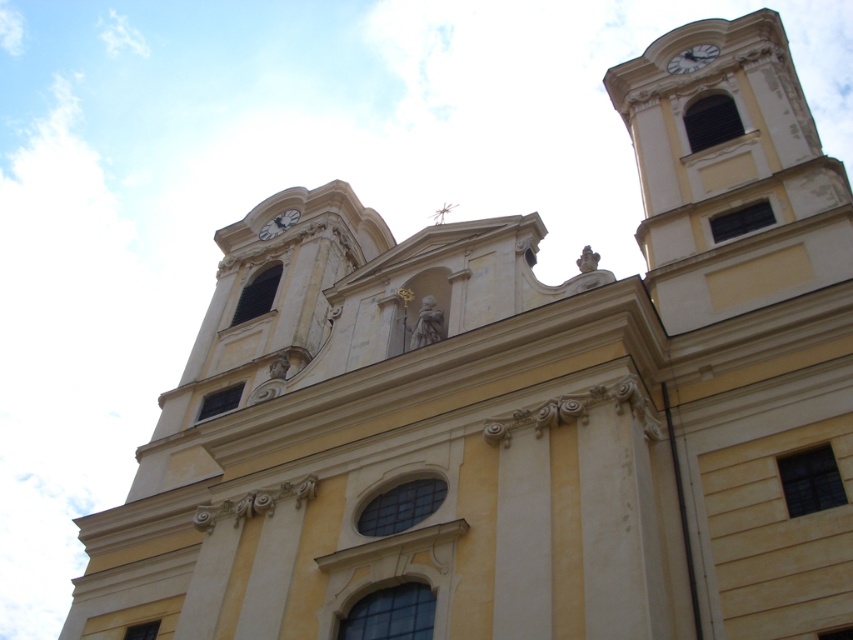
The width and height of the screenshot is (853, 640). In order to click on white glossy clock at upper right in this screenshot , I will do pos(692,58).

Does white glossy clock at upper right appear on the right side of white glossy clock at upper center?

Correct, you'll find white glossy clock at upper right to the right of white glossy clock at upper center.

Does point (682, 58) come closer to viewer compared to point (268, 234)?

That is True.

Identify the location of white glossy clock at upper right. The height and width of the screenshot is (640, 853). (692, 58).